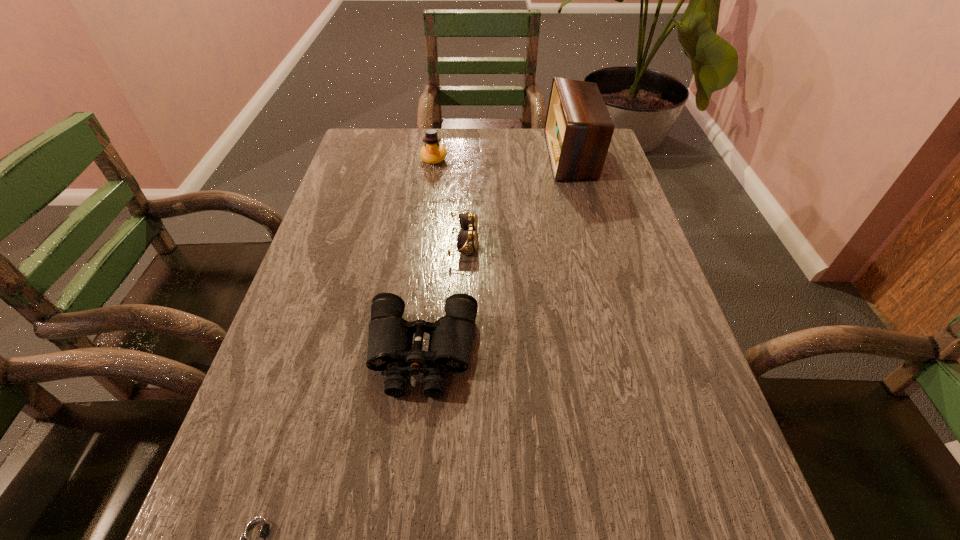
Locate an element on the screen. This screenshot has width=960, height=540. radio receiver is located at coordinates (578, 129).

Where is `the rightmost object`? the rightmost object is located at coordinates (578, 129).

Identify the location of the second tallest object. (433, 152).

The image size is (960, 540). I want to click on the fourth farthest object, so click(390, 337).

You are a GUI agent. You are given a task and a screenshot of the screen. Output one action in this format:
    pyautogui.click(x=<x>, y=<y>)
    Task: Click on the third nearest object
    This screenshot has height=540, width=960.
    Given the screenshot: What is the action you would take?
    click(x=467, y=238)

You are a GUI agent. You are given a task and a screenshot of the screen. Output one action in this format:
    pyautogui.click(x=<x>, y=<y>)
    Task: Click on the goggles
    Image resolution: width=960 pixels, height=540 pixels.
    Given the screenshot: What is the action you would take?
    pyautogui.click(x=467, y=238)

Identify the location of vacant space located on the front-facing side of the tallest object. The image size is (960, 540). (467, 155).

Where is `free space located 0.120m on the front-facing side of the tallest object`? The image size is (960, 540). free space located 0.120m on the front-facing side of the tallest object is located at coordinates (512, 155).

Where is `vacant space located 0.160m on the front-facing side of the tallest object`? The image size is (960, 540). vacant space located 0.160m on the front-facing side of the tallest object is located at coordinates (500, 155).

In order to click on vacant area situated on the front-facing side of the duck in this screenshot , I will do `click(424, 229)`.